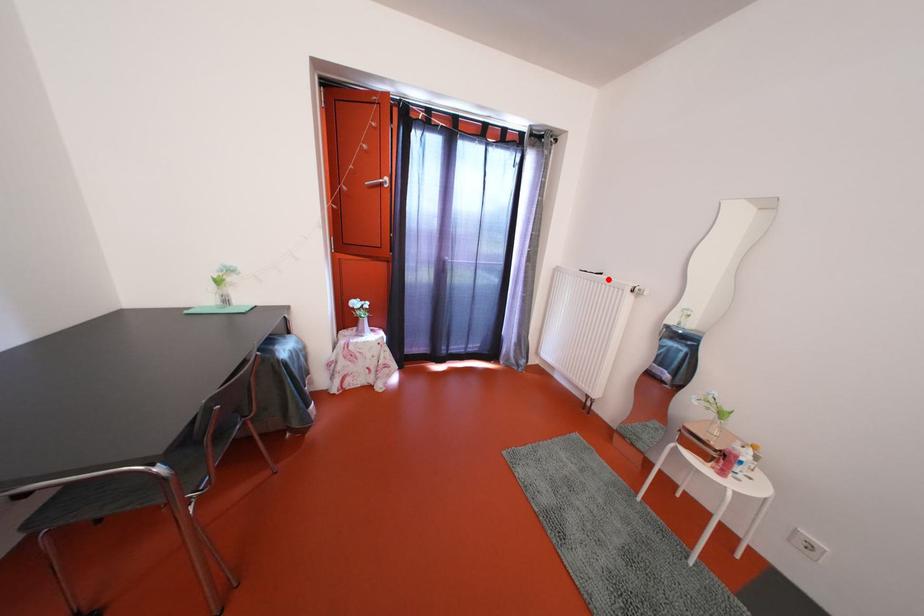
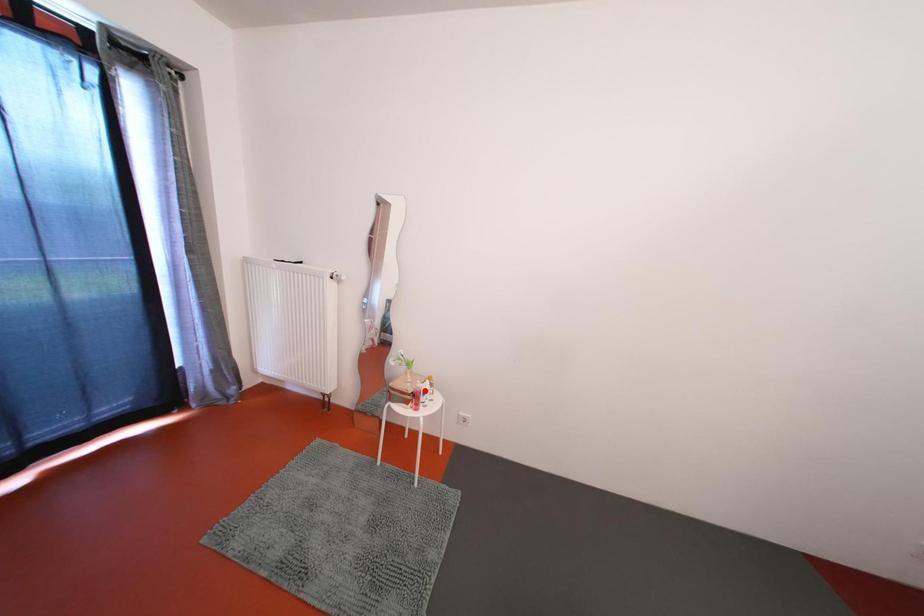
I am providing you with two images of the same scene from different viewpoints. A red point is marked on the first image and another point is marked on the second image. Do the highlighted points in image1 and image2 indicate the same real-world spot?

No